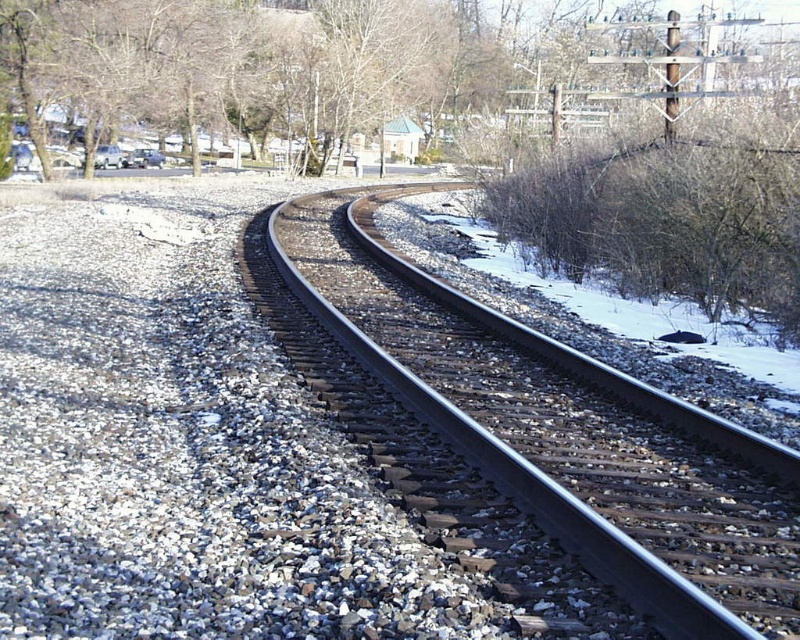
Can you confirm if metal/wooden track at center is positioned above brown leafless tree at upper left?

No.

Is metal/wooden track at center further to camera compared to brown leafless tree at upper left?

No, it is not.

Is point (716, 564) positioned behind point (306, 56)?

No, (716, 564) is in front of (306, 56).

Where is `metal/wooden track at center`? The height and width of the screenshot is (640, 800). metal/wooden track at center is located at coordinates (550, 438).